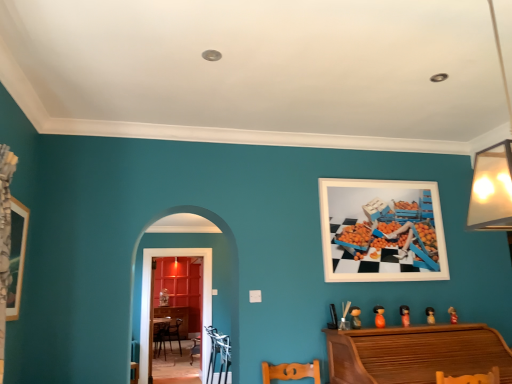
Find the location of `vacant area that is in front of orange matte toy at lower right, the 2th toy viewed from the left`. vacant area that is in front of orange matte toy at lower right, the 2th toy viewed from the left is located at coordinates (380, 329).